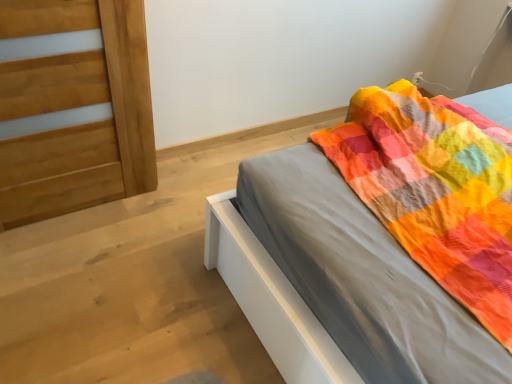
The height and width of the screenshot is (384, 512). I want to click on free space in front of light brown wood door at left, so click(x=73, y=276).